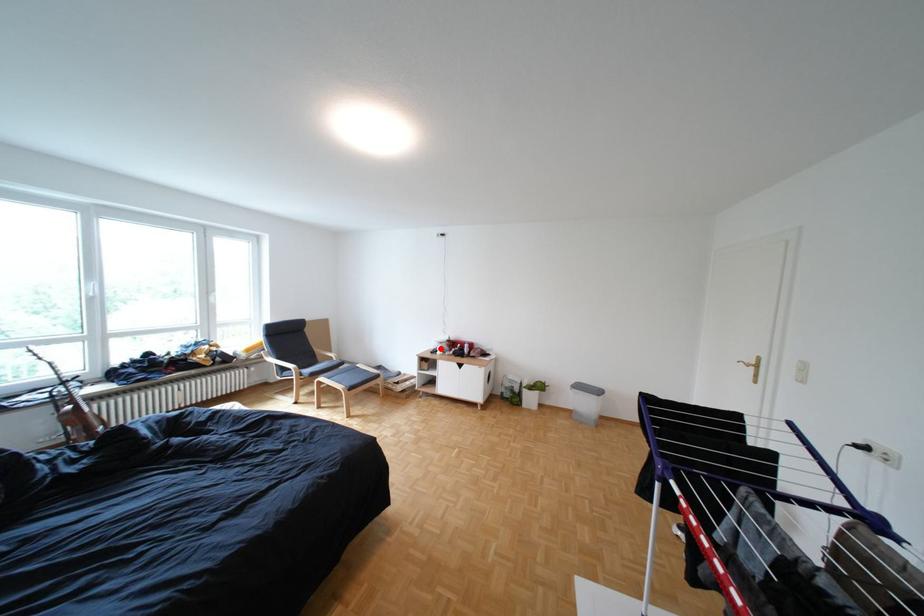
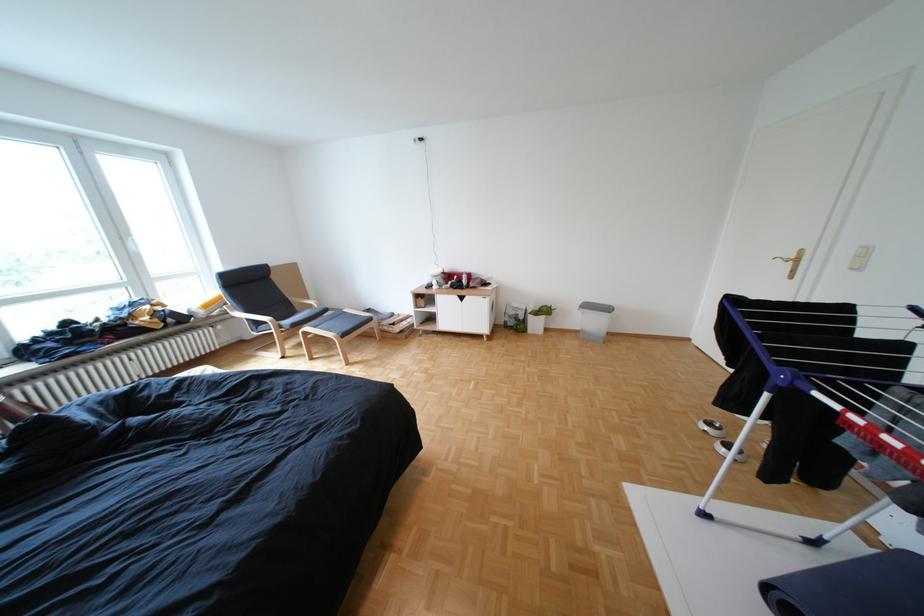
Locate, in the second image, the point that corresponds to the highlighted location in the first image.

(433, 284)